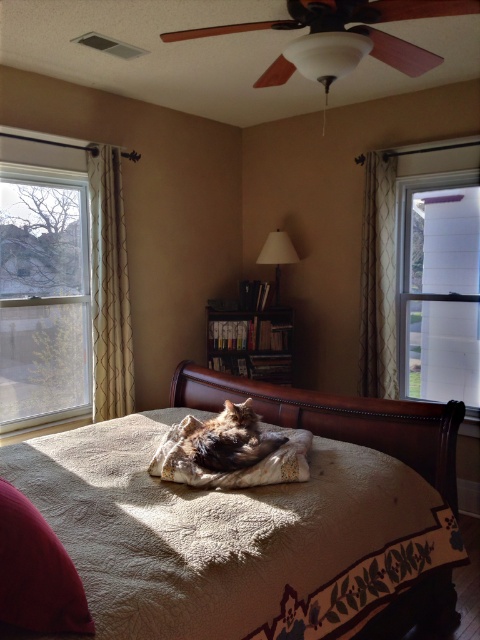
Can you confirm if clear glass window at left is shorter than fluffy beige blanket at center?

In fact, clear glass window at left may be taller than fluffy beige blanket at center.

Can you confirm if clear glass window at left is smaller than fluffy beige blanket at center?

No, clear glass window at left is not smaller than fluffy beige blanket at center.

Who is more distant from viewer, (101, 241) or (240, 472)?

The point (101, 241) is behind.

Identify the location of clear glass window at left. (61, 282).

Who is lower down, fluffy beige blanket at center or fuzzy brown cat at center?

fluffy beige blanket at center is below.

Image resolution: width=480 pixels, height=640 pixels. I want to click on fluffy beige blanket at center, so click(235, 470).

From the picture: Which is above, clear glass window at right or fuzzy brown cat at center?

clear glass window at right is above.

From the picture: Is clear glass window at right thinner than fuzzy brown cat at center?

No, clear glass window at right is not thinner than fuzzy brown cat at center.

Who is more distant from viewer, (448, 364) or (183, 449)?

The point (448, 364) is behind.

Locate an element on the screen. clear glass window at right is located at coordinates (440, 292).